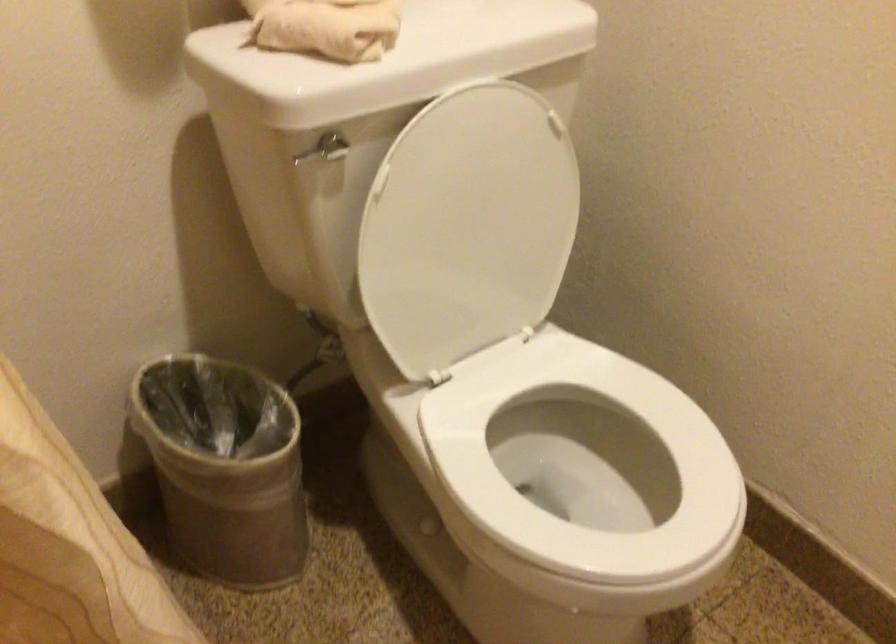
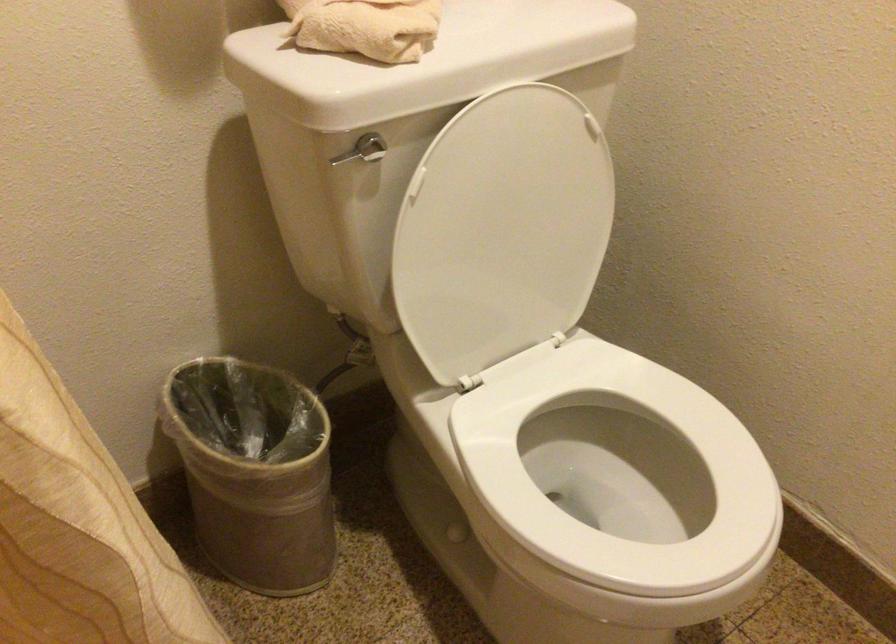
Find the pixel in the second image that matches point 311,152 in the first image.

(348, 155)